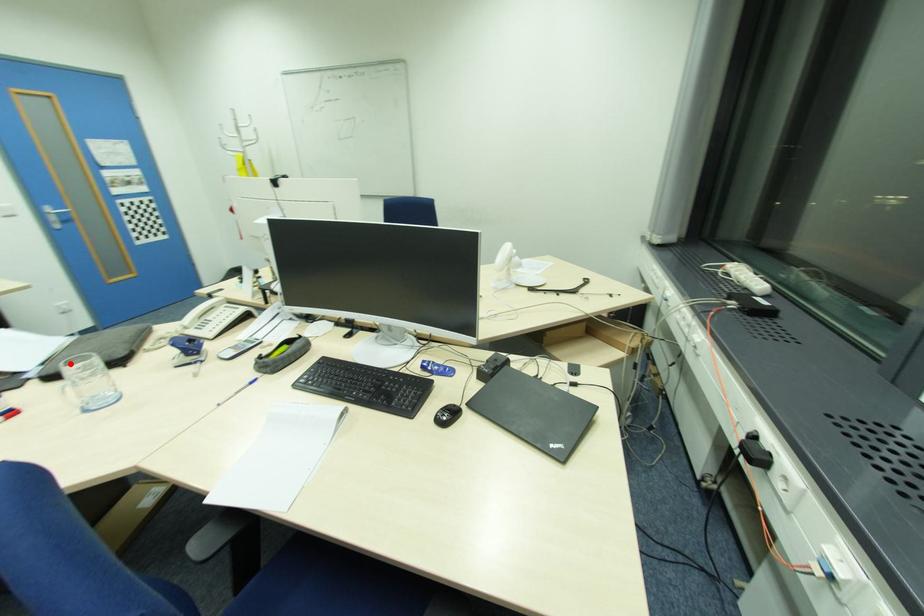
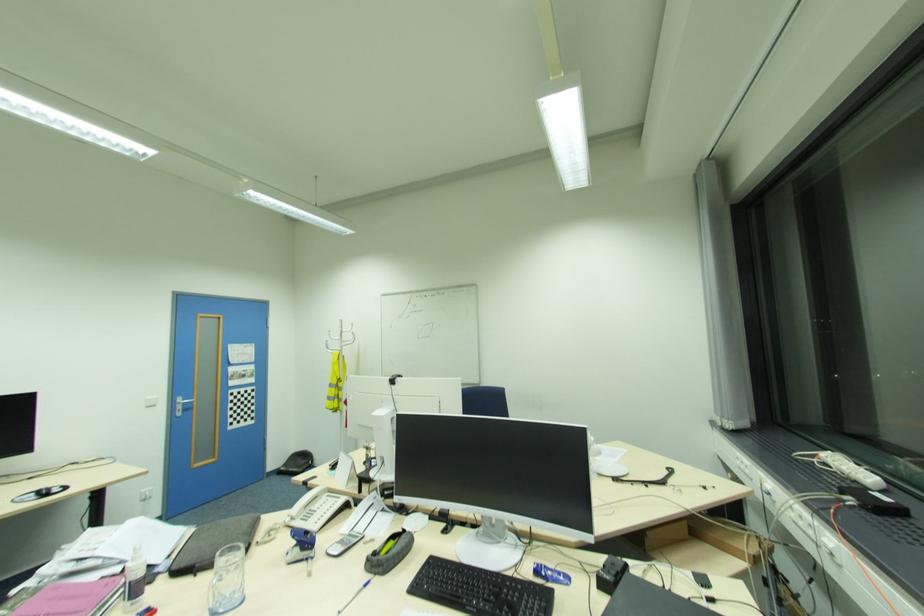
Find the pixel in the second image that matches the highlighted location in the first image.

(225, 554)